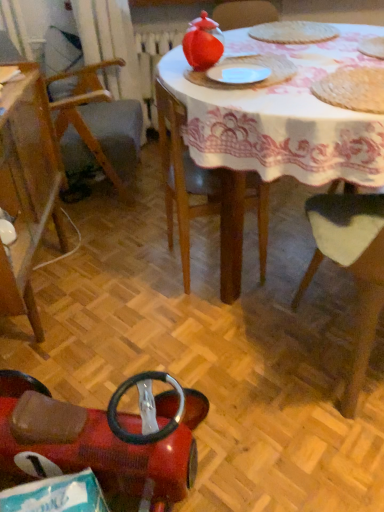
The image size is (384, 512). I want to click on vacant area located to the right-hand side of rubberized red toy car at lower left, the second chair viewed from the left, so click(x=267, y=421).